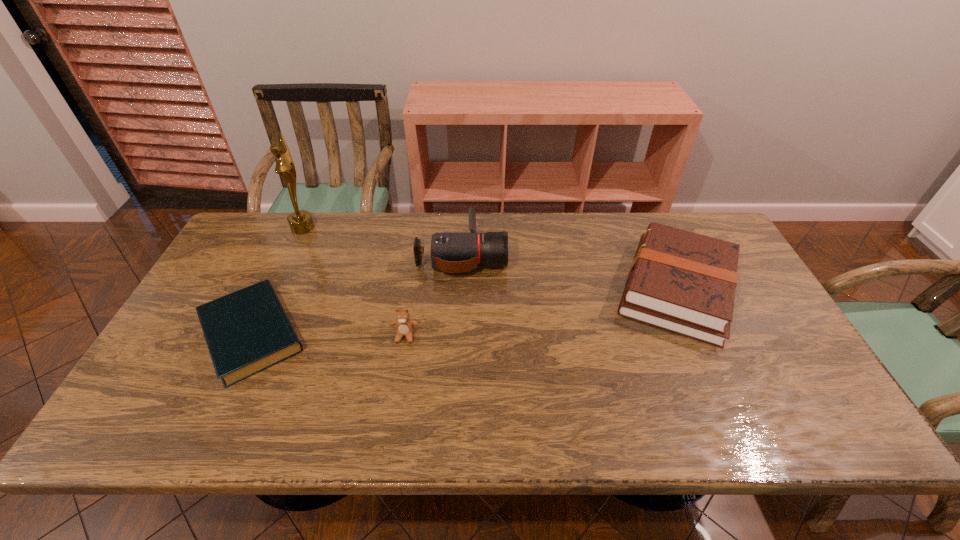
The width and height of the screenshot is (960, 540). I want to click on vacant space that's between the award and the left book, so click(x=277, y=281).

Where is `empty location between the award and the camcorder`? The height and width of the screenshot is (540, 960). empty location between the award and the camcorder is located at coordinates (382, 241).

You are a GUI agent. You are given a task and a screenshot of the screen. Output one action in this format:
    pyautogui.click(x=<x>, y=<y>)
    Task: Click on the free space between the right book and the teddy bear
    The image size is (960, 540).
    Given the screenshot: What is the action you would take?
    pyautogui.click(x=540, y=312)

Locate which object is the fourth closest to the teddy bear. Please provide its 2D coordinates. Your answer should be formatted as a tuple, i.e. [(x, y)], where the tuple contains the x and y coordinates of a point satisfying the conditions above.

[(683, 282)]

Select which object is the closest to the teddy bear. Please provide its 2D coordinates. Your answer should be formatted as a tuple, i.e. [(x, y)], where the tuple contains the x and y coordinates of a point satisfying the conditions above.

[(450, 252)]

I want to click on free location that satisfies the following two spatial constraints: 1. on the lens of the camcorder; 2. on the back side of the right book, so pos(461,289).

This screenshot has height=540, width=960. In order to click on vacant point that satisfies the following two spatial constraints: 1. on the lens of the camcorder; 2. on the front-facing side of the teddy bear in this screenshot , I will do click(x=458, y=336).

The width and height of the screenshot is (960, 540). Identify the location of vacant area in the image that satisfies the following two spatial constraints: 1. on the front-facing side of the tallest object; 2. on the left side of the rightmost object. (274, 289).

Locate an element on the screen. The height and width of the screenshot is (540, 960). vacant region that satisfies the following two spatial constraints: 1. on the lens of the camcorder; 2. on the back side of the taller book is located at coordinates (461, 289).

Image resolution: width=960 pixels, height=540 pixels. I want to click on free spot that satisfies the following two spatial constraints: 1. on the front-facing side of the rightmost object; 2. on the left side of the award, so click(x=274, y=289).